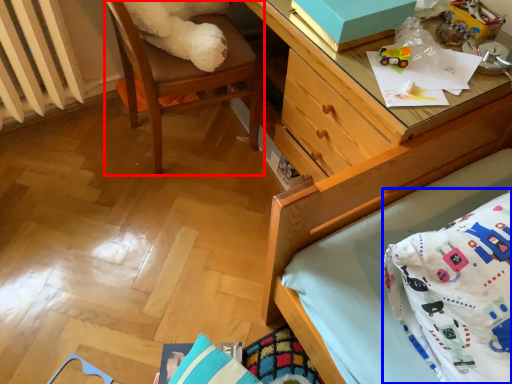
Question: Which object is further to the camera taking this photo, chair (highlighted by a red box) or throw pillow (highlighted by a blue box)?

Choices:
 (A) chair
 (B) throw pillow

Answer: (A)